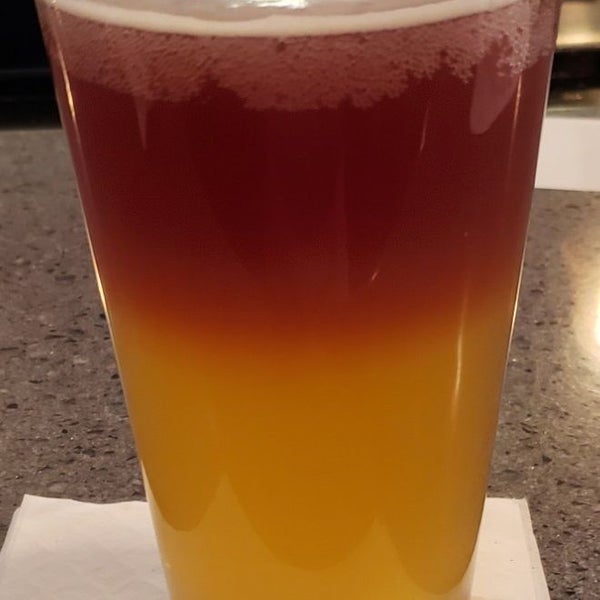
The height and width of the screenshot is (600, 600). In order to click on yellow reflection of ceiling light in this screenshot , I will do `click(594, 325)`.